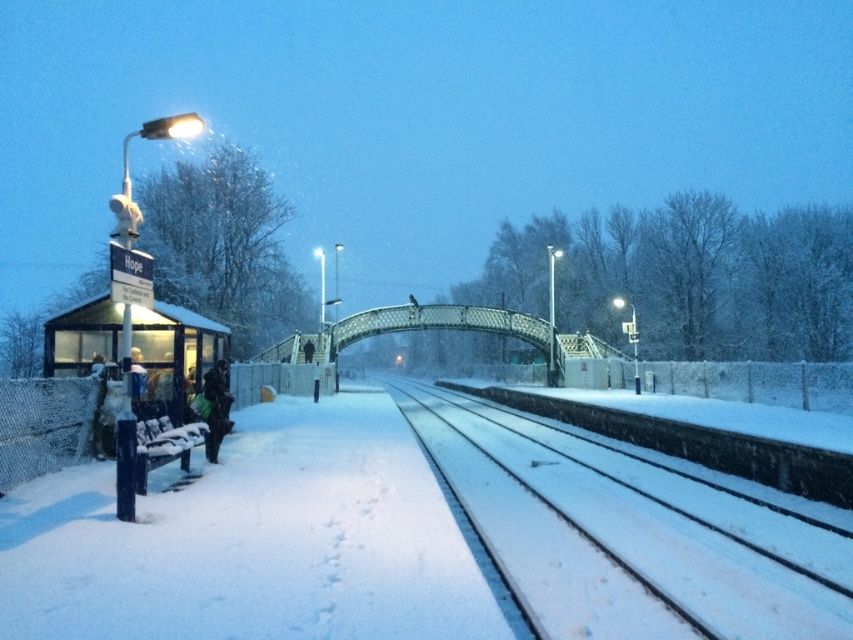
Can you confirm if snow-covered tracks at center is thinner than dark green jacket at left?

In fact, snow-covered tracks at center might be wider than dark green jacket at left.

Is snow-covered tracks at center taller than dark green jacket at left?

No, snow-covered tracks at center is not taller than dark green jacket at left.

Is point (448, 467) positioned in front of point (206, 449)?

That is False.

Locate an element on the screen. The height and width of the screenshot is (640, 853). snow-covered tracks at center is located at coordinates (628, 534).